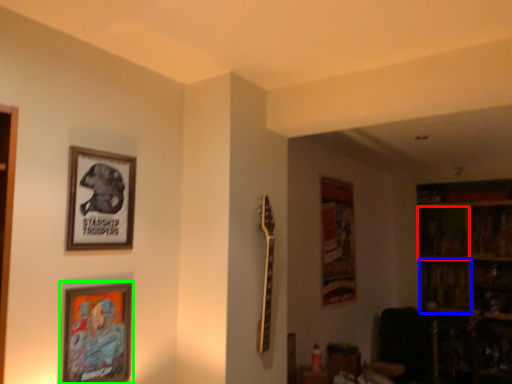
Question: Estimate the real-world distances between objects in this image. Which object is farther from shelf (highlighted by a red box), shelf (highlighted by a blue box) or picture frame (highlighted by a green box)?

Choices:
 (A) shelf
 (B) picture frame

Answer: (B)